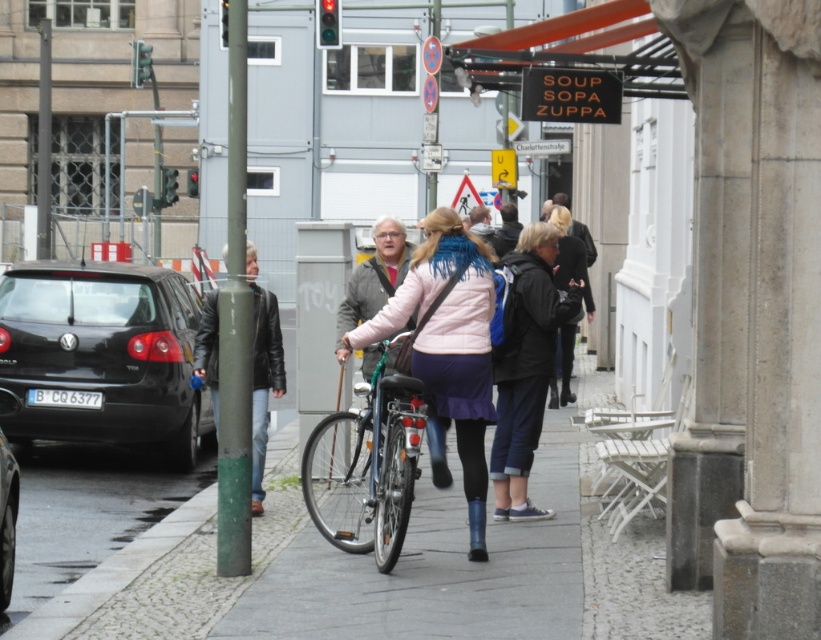
Is point (578, 296) closer to camera compared to point (553, 260)?

Yes, it is.

This screenshot has width=821, height=640. What are the coordinates of `blue denim pants at center` in the screenshot? It's located at click(x=526, y=365).

Does shiny metallic bicycle at center have a greater width compared to blue denim pants at center?

Yes.

Between point (342, 545) and point (544, 365), which one is positioned behind?

Point (544, 365)

This screenshot has width=821, height=640. I want to click on shiny metallic bicycle at center, so click(x=368, y=465).

Is black matte car at left below black glossy car at left?

No.

In the scene shown: Measure the distance from black matte car at left to black glossy car at left.

They are 5.46 meters apart.

Is point (42, 282) farther from viewer compared to point (7, 528)?

Yes, it is behind point (7, 528).

This screenshot has height=640, width=821. I want to click on black matte car at left, so pos(102,356).